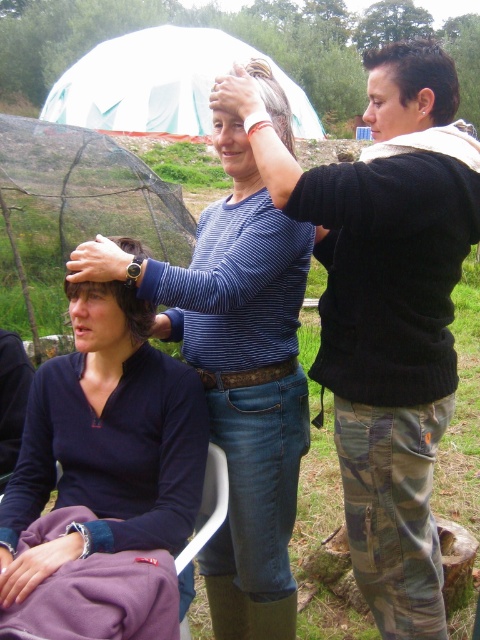
You are a photographer trying to capture a candid shot of the two women in the scene. You need to ensure that both the blue striped sweater at upper center and the blue striped shirt at center are in focus. Given that your camera has a depth of field range of 8 inches, will you be able to achieve this?

The blue striped sweater at upper center is 9.24 inches away from the blue striped shirt at center. Since the distance between them exceeds the camera lens depth of field range of 8 inches, it will be difficult to have both in focus simultaneously.

In the scene described, where is the blue striped shirt at center positioned relative to the white fabric tent at upper center?

The blue striped shirt at center is positioned to the right of the white fabric tent at upper center.

In the scene shown: You are a photographer trying to capture the scene with a camera positioned at the origin point. The camera has a field of view that can only capture objects within a radius of 0.5 units from the origin. Is the blue striped sweater at upper center within the camera frame?

The blue striped sweater at upper center is located at point (385,308), which is outside the camera frame since the distance from the origin is sqrt 0.483 squared plus 0.804 squared equals approximately 0.93 units, exceeding the 0.5 radius limit.